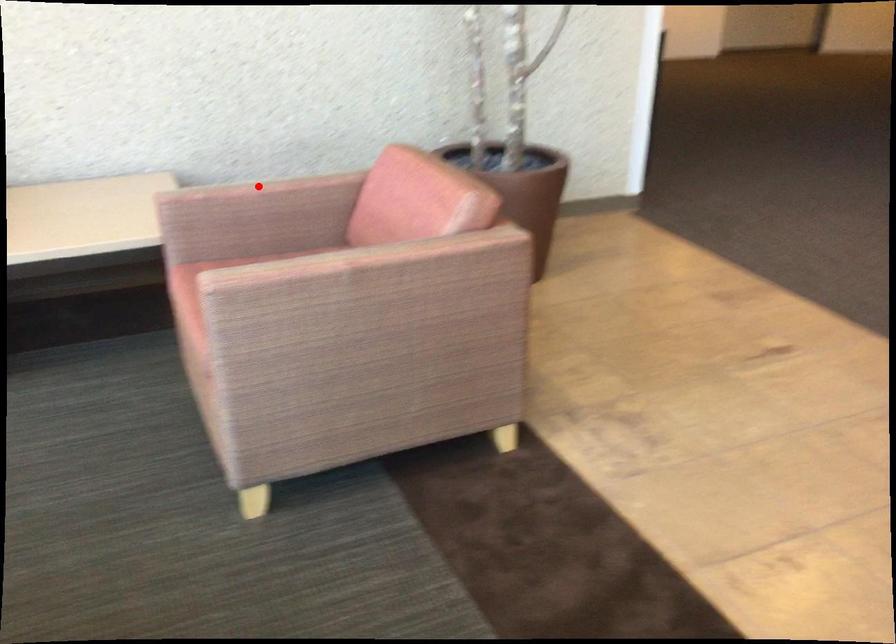
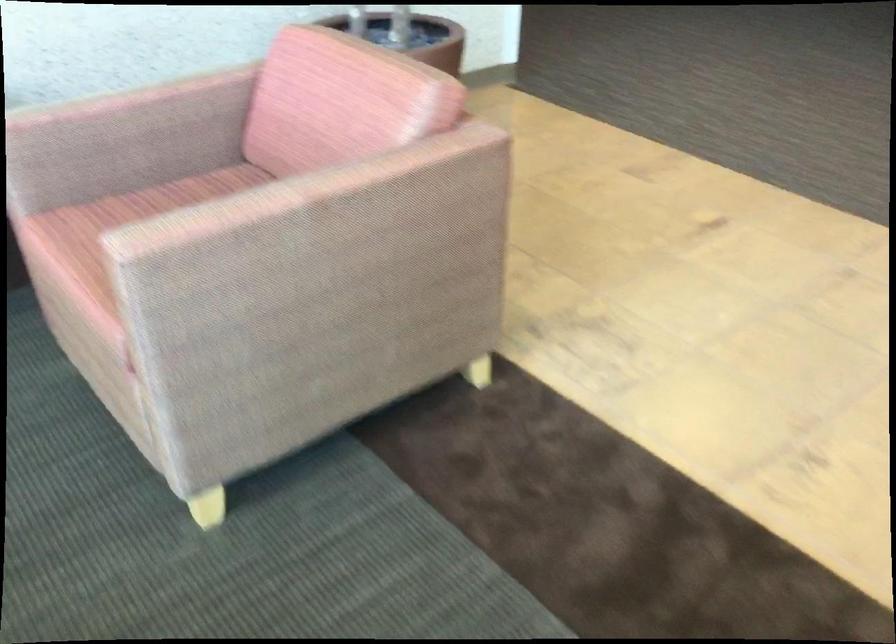
Where in the second image is the point corresponding to the highlighted location from the first image?

(121, 98)